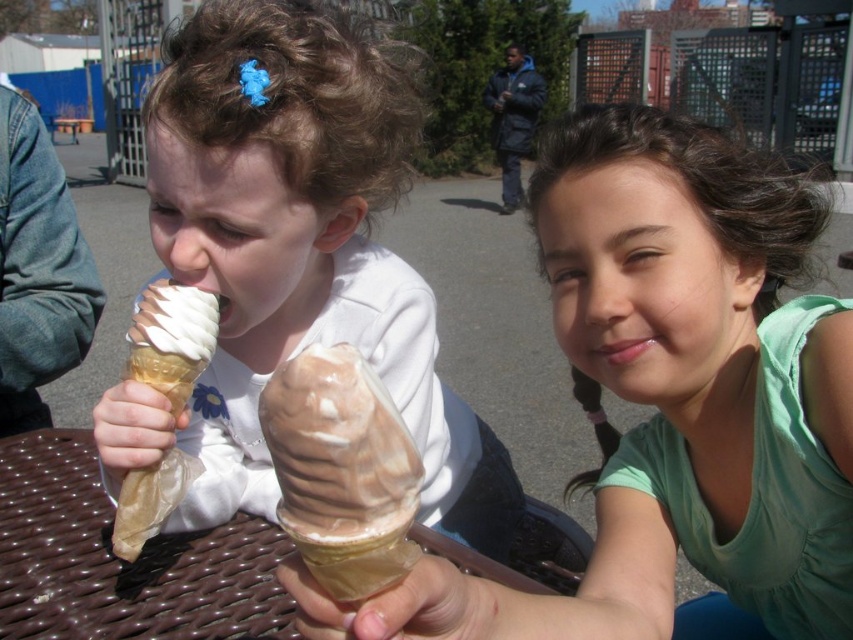
Question: Can you confirm if matte white ice cream cone at left is bigger than swirled chocolate ice cream at center?

Choices:
 (A) no
 (B) yes

Answer: (B)

Question: Is matte brown ice cream cone at center to the right of matte white ice cream cone at left from the viewer's perspective?

Choices:
 (A) yes
 (B) no

Answer: (A)

Question: Considering the real-world distances, which object is farthest from the matte brown ice cream cone at center?

Choices:
 (A) matte white ice cream cone at left
 (B) vanilla and chocolate ice cream at left

Answer: (B)

Question: Which point appears farthest from the camera in this image?

Choices:
 (A) (297, 449)
 (B) (677, 502)

Answer: (B)

Question: Does swirled chocolate ice cream at center have a lesser width compared to vanilla and chocolate ice cream at left?

Choices:
 (A) yes
 (B) no

Answer: (A)

Question: Which object appears closest to the camera in this image?

Choices:
 (A) vanilla and chocolate ice cream at left
 (B) matte white ice cream cone at left

Answer: (B)